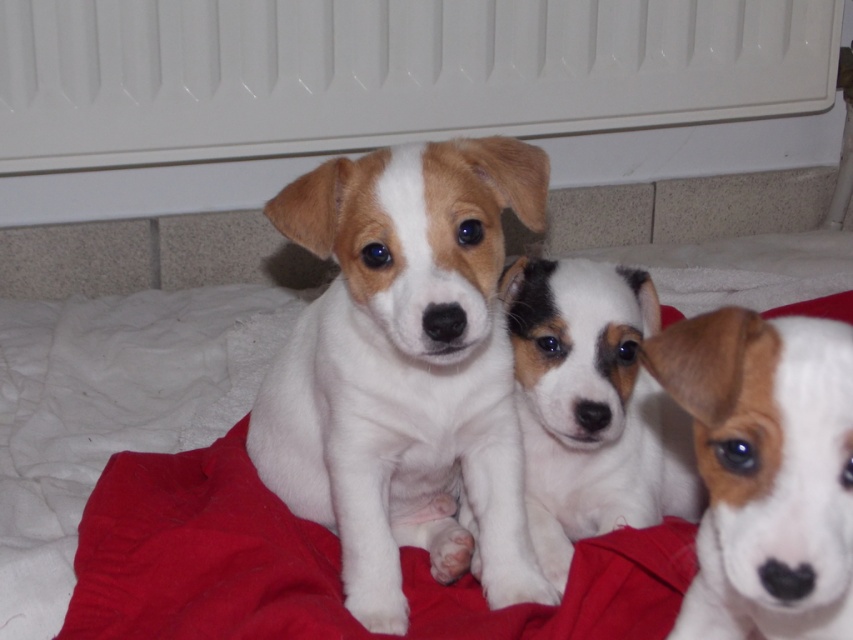
Can you confirm if white fur puppy at center is taller than white fur dog at center?

Yes, white fur puppy at center is taller than white fur dog at center.

How far apart are white fur puppy at center and white fur dog at center?

white fur puppy at center is 12.42 centimeters away from white fur dog at center.

Identify the location of white fur puppy at center. (405, 369).

Is red fabric blanket at center to the right of white fur at center from the viewer's perspective?

In fact, red fabric blanket at center is to the left of white fur at center.

In the scene shown: Between red fabric blanket at center and white fur at center, which one is positioned higher?

white fur at center is above.

Find the location of a particular element. The width and height of the screenshot is (853, 640). red fabric blanket at center is located at coordinates (318, 566).

Based on the photo, is white fur puppy at center above white fur at center?

Yes.

Can you confirm if white fur puppy at center is positioned to the right of white fur at center?

No, white fur puppy at center is not to the right of white fur at center.

Is point (436, 339) positioned after point (741, 330)?

Yes, it is behind point (741, 330).

The image size is (853, 640). What are the coordinates of `white fur puppy at center` in the screenshot? It's located at click(x=405, y=369).